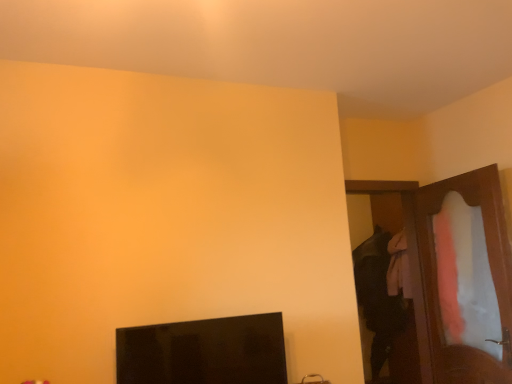
Question: Should I look upward or downward to see wooden dresser at right?

Choices:
 (A) up
 (B) down

Answer: (B)

Question: From a real-world perspective, is wooden dresser at right positioned over black glossy monitor at lower left based on gravity?

Choices:
 (A) yes
 (B) no

Answer: (A)

Question: Is wooden dresser at right oriented towards black glossy monitor at lower left?

Choices:
 (A) yes
 (B) no

Answer: (A)

Question: From a real-world perspective, is wooden dresser at right physically below black glossy monitor at lower left?

Choices:
 (A) yes
 (B) no

Answer: (B)

Question: Is wooden dresser at right with black glossy monitor at lower left?

Choices:
 (A) no
 (B) yes

Answer: (A)

Question: Considering the relative positions of wooden dresser at right and black glossy monitor at lower left in the image provided, is wooden dresser at right to the right of black glossy monitor at lower left from the viewer's perspective?

Choices:
 (A) no
 (B) yes

Answer: (B)

Question: Is wooden dresser at right taller than black glossy monitor at lower left?

Choices:
 (A) no
 (B) yes

Answer: (B)

Question: Is wooden door at right next to black glossy monitor at lower left?

Choices:
 (A) no
 (B) yes

Answer: (A)

Question: Is wooden door at right further to the viewer compared to black glossy monitor at lower left?

Choices:
 (A) no
 (B) yes

Answer: (B)

Question: Is wooden door at right shorter than black glossy monitor at lower left?

Choices:
 (A) yes
 (B) no

Answer: (B)

Question: Can you confirm if wooden door at right is wider than black glossy monitor at lower left?

Choices:
 (A) yes
 (B) no

Answer: (B)

Question: Could you tell me if wooden door at right is facing black glossy monitor at lower left?

Choices:
 (A) no
 (B) yes

Answer: (A)

Question: Considering the relative sizes of wooden door at right and black glossy monitor at lower left in the image provided, is wooden door at right taller than black glossy monitor at lower left?

Choices:
 (A) yes
 (B) no

Answer: (A)

Question: Does wooden dresser at right have a larger size compared to wooden door at right?

Choices:
 (A) no
 (B) yes

Answer: (B)